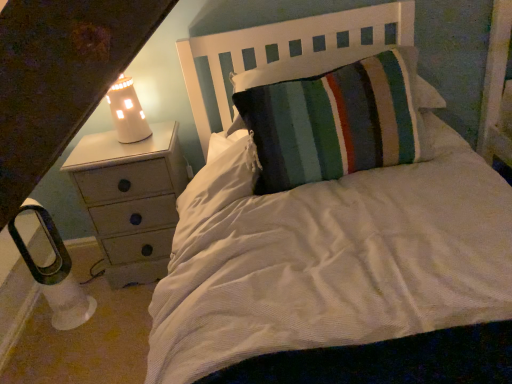
Question: From the image's perspective, is white painted wood chest of drawers at left on top of white plastic lamp at lower left, the 1th lamp positioned from the bottom?

Choices:
 (A) yes
 (B) no

Answer: (A)

Question: Does white painted wood chest of drawers at left turn towards white plastic lamp at lower left, marked as the 1th lamp in a left-to-right arrangement?

Choices:
 (A) yes
 (B) no

Answer: (B)

Question: Considering the relative sizes of white painted wood chest of drawers at left and white plastic lamp at lower left, acting as the second lamp starting from the top, in the image provided, is white painted wood chest of drawers at left shorter than white plastic lamp at lower left, acting as the second lamp starting from the top,?

Choices:
 (A) yes
 (B) no

Answer: (B)

Question: From a real-world perspective, does white painted wood chest of drawers at left sit lower than white plastic lamp at lower left, marked as the 1th lamp in a left-to-right arrangement?

Choices:
 (A) no
 (B) yes

Answer: (A)

Question: From a real-world perspective, is white painted wood chest of drawers at left located higher than white plastic lamp at lower left, marked as the 1th lamp in a left-to-right arrangement?

Choices:
 (A) no
 (B) yes

Answer: (B)

Question: From a real-world perspective, relative to white wood headboard at upper center, is white plastic lamp at lower left, marked as the 1th lamp in a left-to-right arrangement, vertically above or below?

Choices:
 (A) below
 (B) above

Answer: (A)

Question: Does point (68, 301) appear closer or farther from the camera than point (226, 119)?

Choices:
 (A) farther
 (B) closer

Answer: (B)

Question: Based on their positions, is white plastic lamp at lower left, the 1th lamp positioned from the bottom, located to the left or right of white wood headboard at upper center?

Choices:
 (A) left
 (B) right

Answer: (A)

Question: Looking at the image, does white plastic lamp at lower left, acting as the second lamp starting from the top, seem bigger or smaller compared to white wood headboard at upper center?

Choices:
 (A) small
 (B) big

Answer: (A)

Question: In terms of size, does white plastic lamp at lower left, the 2th lamp positioned from the right, appear bigger or smaller than white painted wood chest of drawers at left?

Choices:
 (A) big
 (B) small

Answer: (B)

Question: Is white plastic lamp at lower left, marked as the 1th lamp in a left-to-right arrangement, inside the boundaries of white painted wood chest of drawers at left, or outside?

Choices:
 (A) inside
 (B) outside

Answer: (B)

Question: From the image's perspective, relative to white painted wood chest of drawers at left, is white plastic lamp at lower left, the 2th lamp positioned from the right, above or below?

Choices:
 (A) above
 (B) below

Answer: (B)

Question: From a real-world perspective, is white plastic lamp at lower left, acting as the second lamp starting from the top, above or below white painted wood chest of drawers at left?

Choices:
 (A) above
 (B) below

Answer: (B)

Question: From a real-world perspective, is white wood headboard at upper center positioned above or below white painted wood chest of drawers at left?

Choices:
 (A) below
 (B) above

Answer: (B)

Question: In the image, is white wood headboard at upper center positioned in front of or behind white painted wood chest of drawers at left?

Choices:
 (A) behind
 (B) front

Answer: (B)